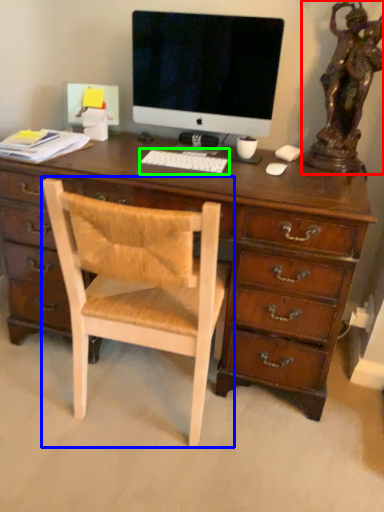
Question: Considering the real-world distances, which object is closest to bronze statue (highlighted by a red box)? chair (highlighted by a blue box) or computer keyboard (highlighted by a green box).

Choices:
 (A) chair
 (B) computer keyboard

Answer: (B)